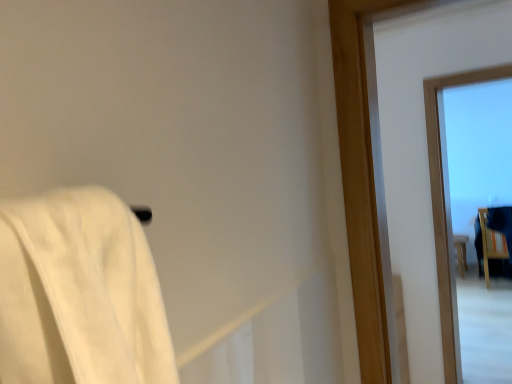
In order to face wooden stool at right, which is the 1th furniture in back-to-front order, should I rotate leftwards or rightwards?

Rotate your view right by about 25.954°.

Describe the element at coordinates (447, 206) in the screenshot. The height and width of the screenshot is (384, 512). I see `transparent glass window at upper right` at that location.

Image resolution: width=512 pixels, height=384 pixels. I want to click on wooden stool at right, placed as the second furniture when sorted from front to back, so click(x=461, y=252).

From the picture: Is transparent glass window at upper right to the right of wooden chair at right, marked as the first furniture in a front-to-back arrangement, from the viewer's perspective?

No.

Can you tell me how much transparent glass window at upper right and wooden chair at right, marked as the first furniture in a front-to-back arrangement, differ in facing direction?

177 degrees.

Considering the sizes of objects transparent glass window at upper right and wooden chair at right, which is the second furniture from back to front, in the image provided, who is thinner, transparent glass window at upper right or wooden chair at right, which is the second furniture from back to front,?

transparent glass window at upper right is thinner.

Would you say transparent glass window at upper right is part of wooden chair at right, marked as the first furniture in a front-to-back arrangement,'s contents?

No, wooden chair at right, marked as the first furniture in a front-to-back arrangement, does not contain transparent glass window at upper right.

Is wooden chair at right, which is the second furniture from back to front, bigger than transparent glass window at upper right?

Correct, wooden chair at right, which is the second furniture from back to front, is larger in size than transparent glass window at upper right.

From the image's perspective, which is below, wooden chair at right, marked as the first furniture in a front-to-back arrangement, or transparent glass window at upper right?

From the image's view, wooden chair at right, marked as the first furniture in a front-to-back arrangement, is below.

From a real-world perspective, who is located higher, wooden chair at right, which is the second furniture from back to front, or transparent glass window at upper right?

From a 3D spatial view, transparent glass window at upper right is above.

Where is `furniture located on the right of wooden stool at right, placed as the second furniture when sorted from front to back`? furniture located on the right of wooden stool at right, placed as the second furniture when sorted from front to back is located at coordinates (490, 244).

Does wooden stool at right, which is the 1th furniture in back-to-front order, have a larger size compared to wooden chair at right, marked as the first furniture in a front-to-back arrangement?

Incorrect, wooden stool at right, which is the 1th furniture in back-to-front order, is not larger than wooden chair at right, marked as the first furniture in a front-to-back arrangement.

Considering the relative sizes of wooden stool at right, placed as the second furniture when sorted from front to back, and wooden chair at right, marked as the first furniture in a front-to-back arrangement, in the image provided, is wooden stool at right, placed as the second furniture when sorted from front to back, thinner than wooden chair at right, marked as the first furniture in a front-to-back arrangement,?

Yes, wooden stool at right, placed as the second furniture when sorted from front to back, is thinner than wooden chair at right, marked as the first furniture in a front-to-back arrangement.

Which is behind, wooden stool at right, placed as the second furniture when sorted from front to back, or wooden chair at right, which is the second furniture from back to front?

wooden stool at right, placed as the second furniture when sorted from front to back, is behind.

Could you measure the distance between transparent glass window at upper right and wooden stool at right, placed as the second furniture when sorted from front to back?

transparent glass window at upper right is 3.68 meters from wooden stool at right, placed as the second furniture when sorted from front to back.

Is point (444, 156) positioned after point (456, 239)?

No, (444, 156) is closer to viewer.

Which object is positioned more to the right, transparent glass window at upper right or wooden stool at right, which is the 1th furniture in back-to-front order?

wooden stool at right, which is the 1th furniture in back-to-front order, is more to the right.

From the image's perspective, between transparent glass window at upper right and wooden stool at right, placed as the second furniture when sorted from front to back, who is located below?

wooden stool at right, placed as the second furniture when sorted from front to back.

Considering the relative positions of wooden chair at right, marked as the first furniture in a front-to-back arrangement, and wooden stool at right, placed as the second furniture when sorted from front to back, in the image provided, is wooden chair at right, marked as the first furniture in a front-to-back arrangement, to the left or to the right of wooden stool at right, placed as the second furniture when sorted from front to back,?

In the image, wooden chair at right, marked as the first furniture in a front-to-back arrangement, appears on the right side of wooden stool at right, placed as the second furniture when sorted from front to back.

Is point (511, 210) closer to viewer compared to point (459, 256)?

Yes, point (511, 210) is in front of point (459, 256).

Between wooden chair at right, which is the second furniture from back to front, and wooden stool at right, placed as the second furniture when sorted from front to back, which one has more height?

wooden chair at right, which is the second furniture from back to front, is taller.

From the image's perspective, is wooden chair at right, marked as the first furniture in a front-to-back arrangement, located above or below wooden stool at right, placed as the second furniture when sorted from front to back?

wooden chair at right, marked as the first furniture in a front-to-back arrangement, is situated higher than wooden stool at right, placed as the second furniture when sorted from front to back, in the image.

Is wooden stool at right, placed as the second furniture when sorted from front to back, not within transparent glass window at upper right?

Yes.

Does wooden stool at right, placed as the second furniture when sorted from front to back, have a greater height compared to transparent glass window at upper right?

No, wooden stool at right, placed as the second furniture when sorted from front to back, is not taller than transparent glass window at upper right.

Can you tell me how much wooden stool at right, placed as the second furniture when sorted from front to back, and transparent glass window at upper right differ in facing direction?

The angle between the facing direction of wooden stool at right, placed as the second furniture when sorted from front to back, and the facing direction of transparent glass window at upper right is 2.26 degrees.

At what (x,y) coordinates should I click in order to perform the action: click on window above the wooden chair at right, marked as the first furniture in a front-to-back arrangement (from the image's perspective). Please return your answer as a coordinate pair (x, y). The width and height of the screenshot is (512, 384). Looking at the image, I should click on (447, 206).

Locate an element on the screen. This screenshot has height=384, width=512. window on the left side of wooden chair at right, marked as the first furniture in a front-to-back arrangement is located at coordinates (447, 206).

Looking at the image, which one is located further to wooden stool at right, placed as the second furniture when sorted from front to back, wooden chair at right, marked as the first furniture in a front-to-back arrangement, or transparent glass window at upper right?

Among the two, transparent glass window at upper right is located further to wooden stool at right, placed as the second furniture when sorted from front to back.

Estimate the real-world distances between objects in this image. Which object is further from wooden chair at right, marked as the first furniture in a front-to-back arrangement, wooden stool at right, which is the 1th furniture in back-to-front order, or transparent glass window at upper right?

transparent glass window at upper right lies further to wooden chair at right, marked as the first furniture in a front-to-back arrangement, than the other object.

Estimate the real-world distances between objects in this image. Which object is further from wooden stool at right, which is the 1th furniture in back-to-front order, transparent glass window at upper right or wooden chair at right, marked as the first furniture in a front-to-back arrangement?

transparent glass window at upper right.

Which object lies further to the anchor point transparent glass window at upper right, wooden chair at right, which is the second furniture from back to front, or wooden stool at right, which is the 1th furniture in back-to-front order?

Based on the image, wooden stool at right, which is the 1th furniture in back-to-front order, appears to be further to transparent glass window at upper right.

Looking at the image, which one is located further to wooden chair at right, marked as the first furniture in a front-to-back arrangement, transparent glass window at upper right or wooden stool at right, which is the 1th furniture in back-to-front order?

transparent glass window at upper right.

From the image, which object appears to be nearer to transparent glass window at upper right, wooden stool at right, which is the 1th furniture in back-to-front order, or wooden chair at right, marked as the first furniture in a front-to-back arrangement?

Based on the image, wooden chair at right, marked as the first furniture in a front-to-back arrangement, appears to be nearer to transparent glass window at upper right.

At what (x,y) coordinates should I click in order to perform the action: click on furniture between transparent glass window at upper right and wooden stool at right, which is the 1th furniture in back-to-front order, from front to back. Please return your answer as a coordinate pair (x, y). Image resolution: width=512 pixels, height=384 pixels. Looking at the image, I should click on (490, 244).